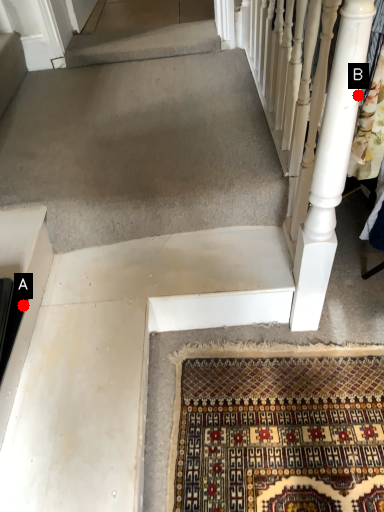
Question: Two points are circled on the image, labeled by A and B beside each circle. Which of the following is the closest to the observer?

Choices:
 (A) A is closer
 (B) B is closer

Answer: (B)